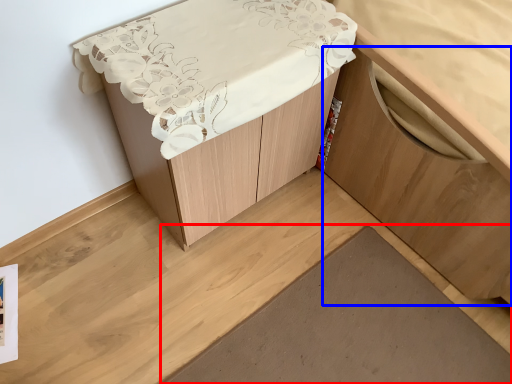
Question: Which point is closer to the camera, plank (highlighted by a red box) or cabinetry (highlighted by a blue box)?

Choices:
 (A) plank
 (B) cabinetry

Answer: (B)